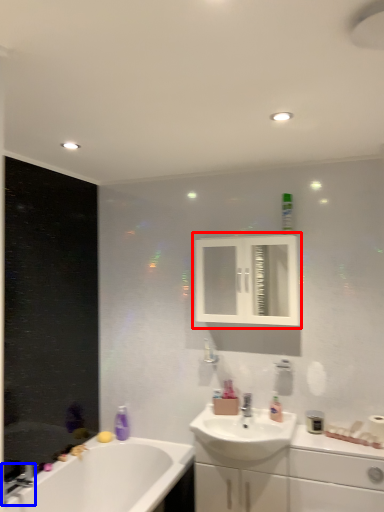
Question: Which object appears closest to the camera in this image, medicine cabinet (highlighted by a red box) or tap (highlighted by a blue box)?

Choices:
 (A) medicine cabinet
 (B) tap

Answer: (B)